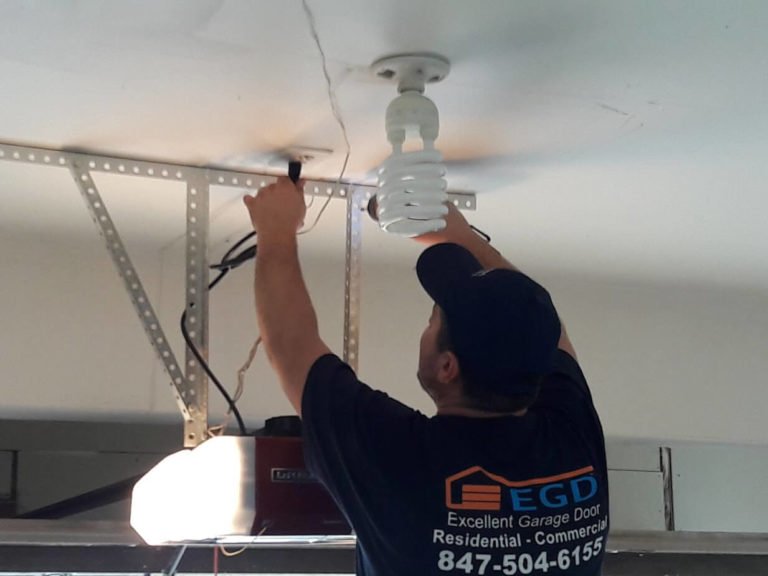
At what (x,y) coordinates should I click in order to perform the action: click on light covering. Please return your answer as a coordinate pair (x, y). The image size is (768, 576). Looking at the image, I should click on (209, 490).